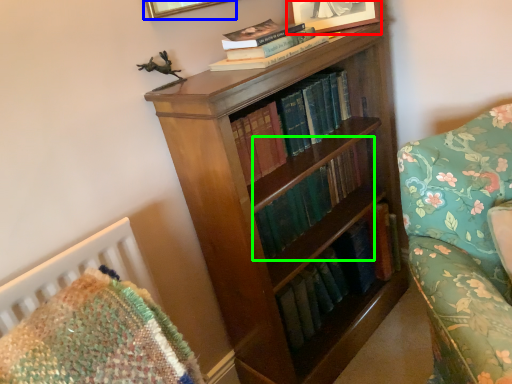
Question: Which is nearer to the picture frame (highlighted by a red box)? picture frame (highlighted by a blue box) or book (highlighted by a green box).

Choices:
 (A) picture frame
 (B) book

Answer: (A)